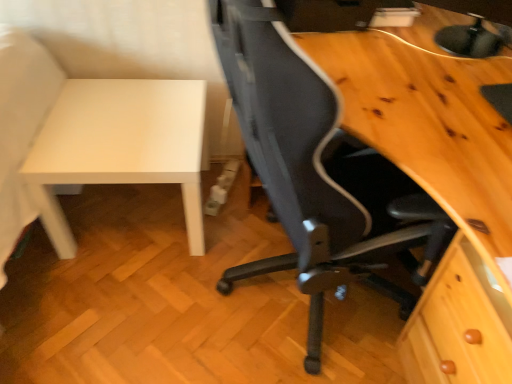
I want to click on free space to the left of matte black monitor at upper right, so click(378, 58).